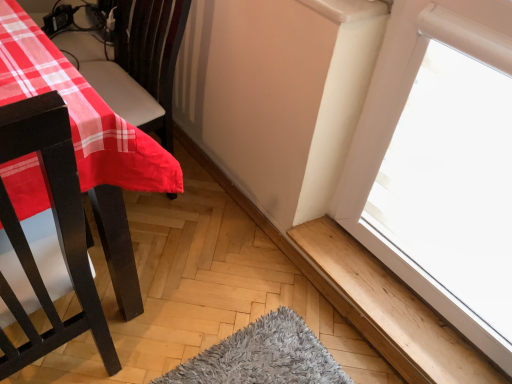
Question: Can we say wooden at lower right lies outside matte plastic table at left?

Choices:
 (A) yes
 (B) no

Answer: (A)

Question: From a real-world perspective, is wooden at lower right physically above matte plastic table at left?

Choices:
 (A) no
 (B) yes

Answer: (A)

Question: Is wooden at lower right at the right side of matte plastic table at left?

Choices:
 (A) no
 (B) yes

Answer: (B)

Question: Is wooden at lower right positioned behind matte plastic table at left?

Choices:
 (A) no
 (B) yes

Answer: (B)

Question: Would you consider wooden at lower right to be distant from matte plastic table at left?

Choices:
 (A) yes
 (B) no

Answer: (B)

Question: Is matte plastic table at left a part of wooden at lower right?

Choices:
 (A) yes
 (B) no

Answer: (B)

Question: Is matte plastic table at left directly adjacent to wooden at lower right?

Choices:
 (A) no
 (B) yes

Answer: (A)

Question: Can you confirm if matte plastic table at left is positioned to the left of wooden at lower right?

Choices:
 (A) no
 (B) yes

Answer: (B)

Question: Is matte plastic table at left looking in the opposite direction of wooden at lower right?

Choices:
 (A) no
 (B) yes

Answer: (A)

Question: Is matte plastic table at left behind wooden at lower right?

Choices:
 (A) no
 (B) yes

Answer: (A)

Question: From a real-world perspective, is matte plastic table at left located beneath wooden at lower right?

Choices:
 (A) no
 (B) yes

Answer: (A)

Question: From a real-world perspective, is matte plastic table at left on wooden at lower right?

Choices:
 (A) yes
 (B) no

Answer: (A)

Question: From the image's perspective, relative to matte plastic table at left, is wooden at lower right above or below?

Choices:
 (A) below
 (B) above

Answer: (A)